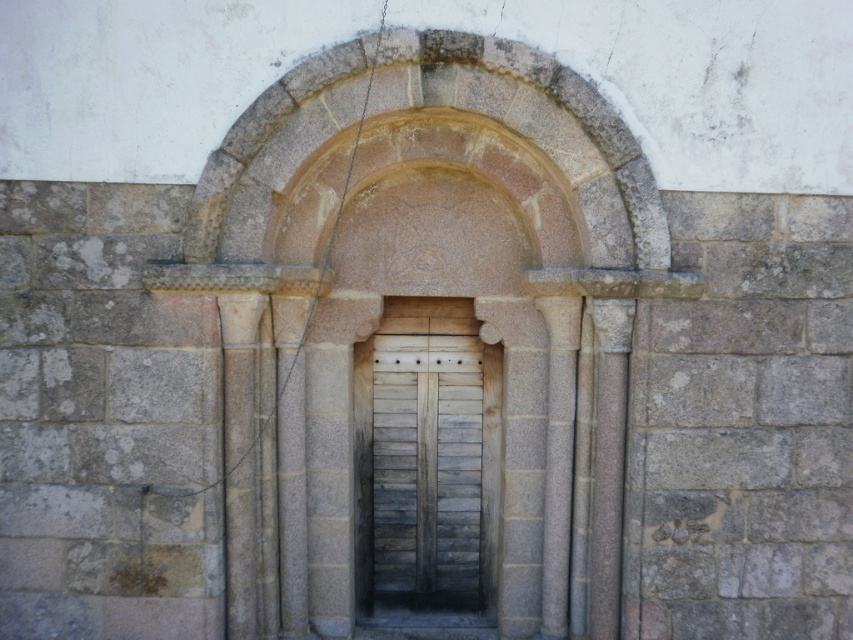
Question: Which point appears closest to the camera in this image?

Choices:
 (A) (601, 541)
 (B) (230, 483)
 (C) (463, 582)
 (D) (379, 289)

Answer: (B)

Question: Which point is closer to the camera?

Choices:
 (A) (254, 540)
 (B) (460, 244)
 (C) (601, 326)
 (D) (413, 504)

Answer: (C)

Question: Does gray stone pillar at center appear on the left side of smooth stone pillar at center?

Choices:
 (A) yes
 (B) no

Answer: (B)

Question: Can you confirm if stone textured arch at center is bigger than gray stone pillar at center?

Choices:
 (A) yes
 (B) no

Answer: (A)

Question: Does stone textured arch at center have a larger size compared to gray stone pillar at center?

Choices:
 (A) yes
 (B) no

Answer: (A)

Question: Which object is farther from the camera taking this photo?

Choices:
 (A) gray stone column at center
 (B) smooth stone pillar at center

Answer: (B)